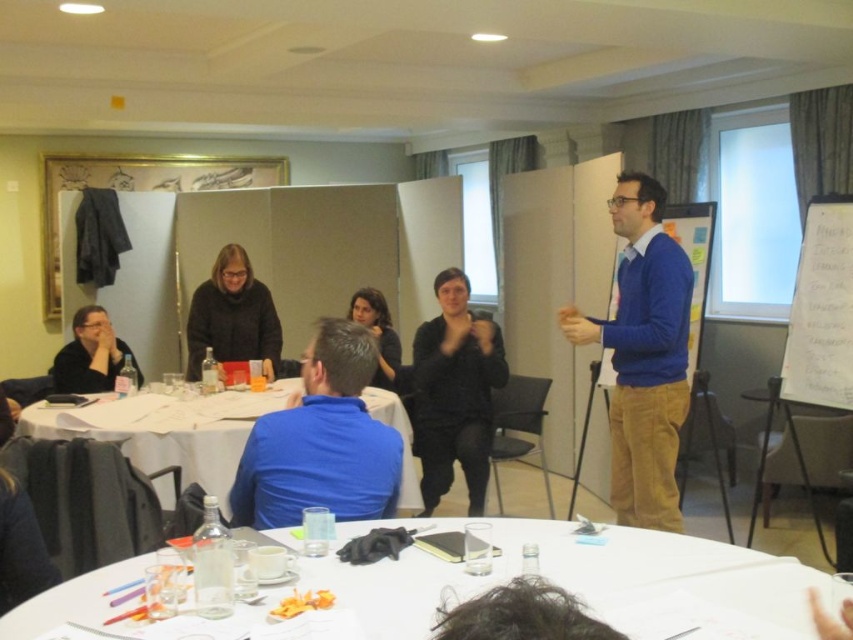
Question: Which of these objects is positioned farthest from the blue corduroy sweater at center?

Choices:
 (A) matte black shirt at lower left
 (B) blue matte shirt at center
 (C) white glossy table at center
 (D) white paper table at center

Answer: (A)

Question: Can you confirm if white glossy table at center is positioned to the left of matte black shirt at lower left?

Choices:
 (A) yes
 (B) no

Answer: (B)

Question: Is white glossy table at center bigger than blue matte shirt at center?

Choices:
 (A) yes
 (B) no

Answer: (B)

Question: Based on their relative distances, which object is farther from the blue corduroy sweater at center?

Choices:
 (A) matte black shirt at lower left
 (B) white glossy table at center

Answer: (A)

Question: Estimate the real-world distances between objects in this image. Which object is farther from the white glossy table at center?

Choices:
 (A) blue corduroy sweater at center
 (B) blue matte shirt at center
 (C) white paper table at center
 (D) matte black shirt at lower left

Answer: (D)

Question: Where is white paper table at center located in relation to matte black shirt at lower left in the image?

Choices:
 (A) below
 (B) above

Answer: (A)